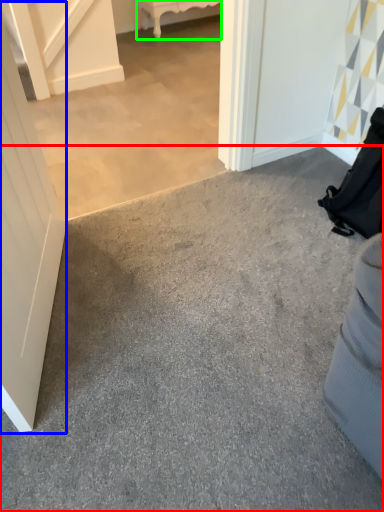
Question: Considering the real-world distances, which object is farthest from concrete (highlighted by a red box)? door (highlighted by a blue box) or furniture (highlighted by a green box)?

Choices:
 (A) door
 (B) furniture

Answer: (B)